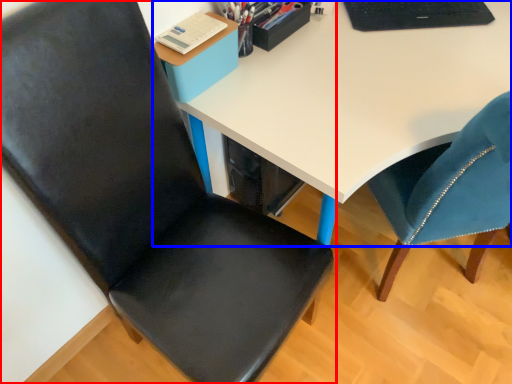
Question: Which object appears closest to the camera in this image, chair (highlighted by a red box) or desk (highlighted by a blue box)?

Choices:
 (A) chair
 (B) desk

Answer: (A)